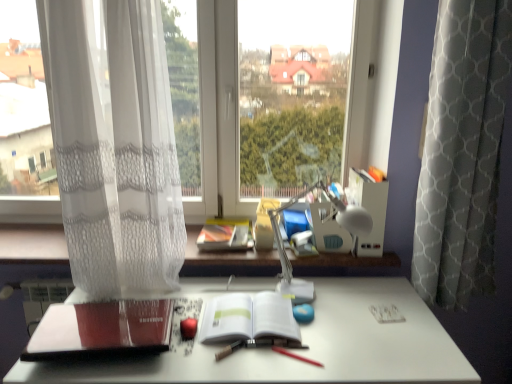
Locate an element on the screen. Image resolution: width=512 pixels, height=384 pixels. vacant point to the right of white plastic table lamp at center is located at coordinates (390, 312).